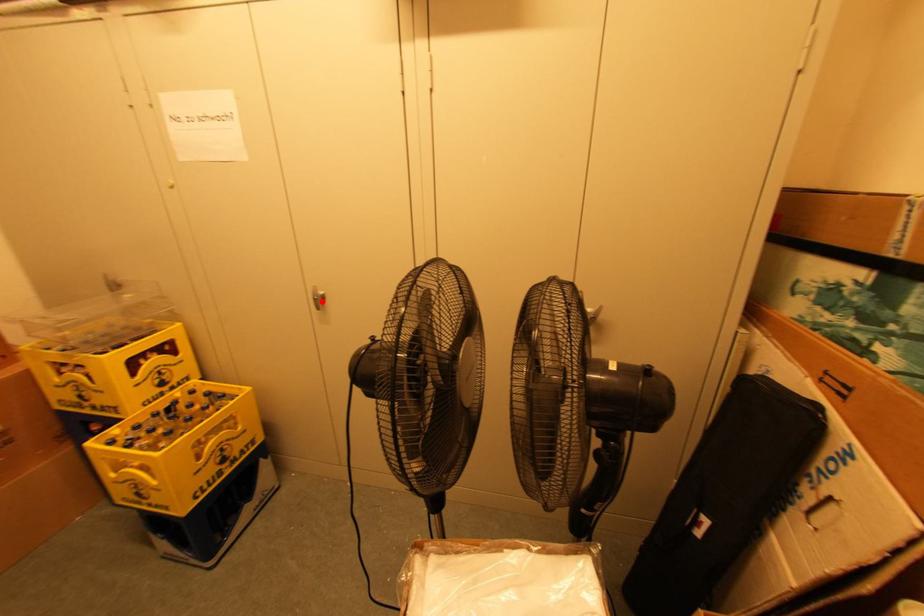
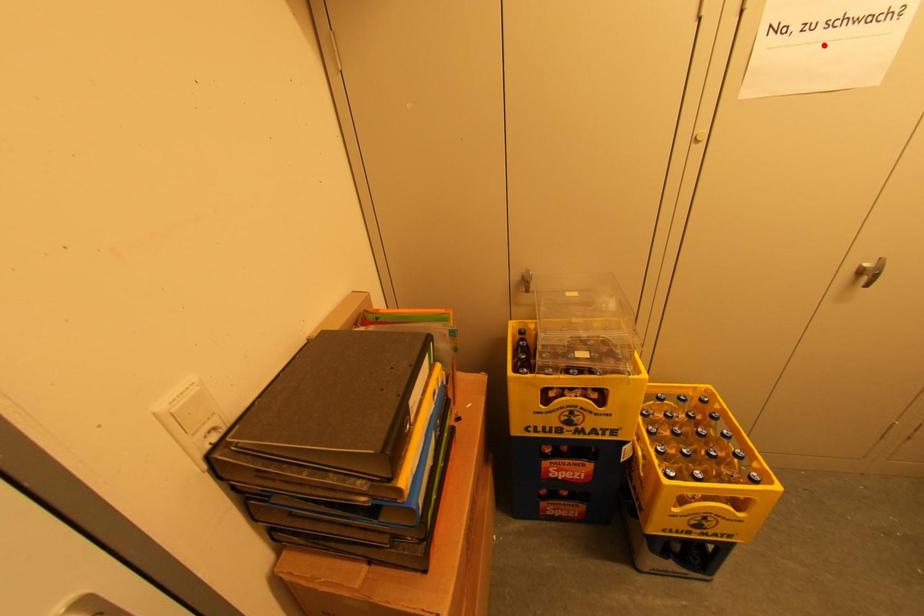
I am providing you with two images of the same scene from different viewpoints. A red point is marked on the first image and another point is marked on the second image. Does the point marked in image1 correspond to the same location as the one in image2?

No